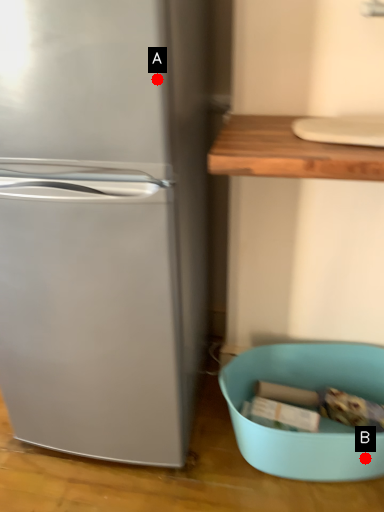
Question: Two points are circled on the image, labeled by A and B beside each circle. Which point appears closest to the camera in this image?

Choices:
 (A) A is closer
 (B) B is closer

Answer: (A)